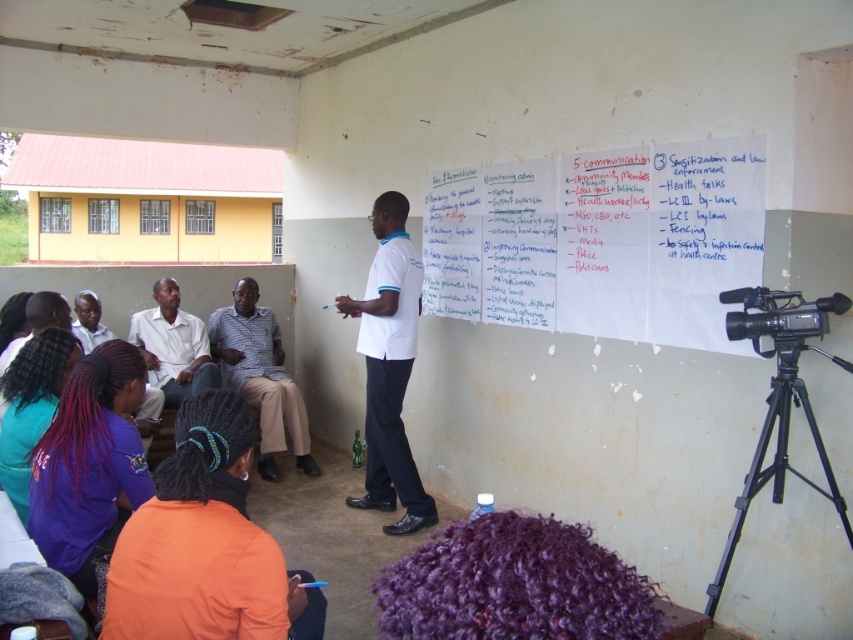
You are a person who is 5 feet tall standing in the room. You want to reach the white paper at upper right from where you are standing near the checkered fabric shirt at center. Can you stretch your arm to touch it without moving your feet?

The distance between the white paper at upper right and checkered fabric shirt at center is 6.32 feet. Since you are 5 feet tall, your arm reach would be limited to around 6 feet at maximum. Therefore, you cannot stretch your arm to touch the white paper at upper right from that position.

You are standing in the room looking at the scene. Where is the purple fabric hair at lower left located in terms of its 2D coordinates?

The purple fabric hair at lower left is located at the 2D coordinates point (90, 464).

You are observing a presentation in a room with a stained ceiling. There are two people wearing white shirts in the scene. One is the white shirt at center and the other is the matte white shirt at upper left. Based on their positions, which person is standing closer to the front of the room?

The white shirt at center is located below the matte white shirt at upper left, meaning the white shirt at center is closer to the front of the room.